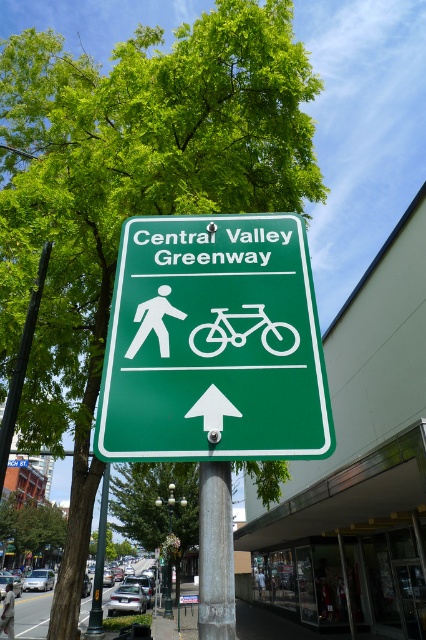
What do you see at coordinates (213, 342) in the screenshot? I see `green matte sign at upper center` at bounding box center [213, 342].

Image resolution: width=426 pixels, height=640 pixels. What are the coordinates of `green matte sign at upper center` in the screenshot? It's located at (213, 342).

Does gray metallic pole at center appear over metallic silver bike lane at lower left?

Indeed, gray metallic pole at center is positioned over metallic silver bike lane at lower left.

From the picture: Can you confirm if gray metallic pole at center is positioned to the right of metallic silver bike lane at lower left?

Yes, gray metallic pole at center is to the right of metallic silver bike lane at lower left.

Is point (207, 464) positioned in front of point (2, 637)?

Yes, point (207, 464) is closer to viewer.

This screenshot has height=640, width=426. What are the coordinates of `gray metallic pole at center` in the screenshot? It's located at [215, 552].

Who is positioned more to the right, metallic silver bike lane at lower left or metallic pole at lower left?

metallic pole at lower left is more to the right.

Is metallic silver bike lane at lower left bigger than metallic pole at lower left?

Yes, metallic silver bike lane at lower left is bigger than metallic pole at lower left.

What do you see at coordinates (32, 614) in the screenshot? I see `metallic silver bike lane at lower left` at bounding box center [32, 614].

The width and height of the screenshot is (426, 640). Find the location of `metallic silver bike lane at lower left`. metallic silver bike lane at lower left is located at coordinates (32, 614).